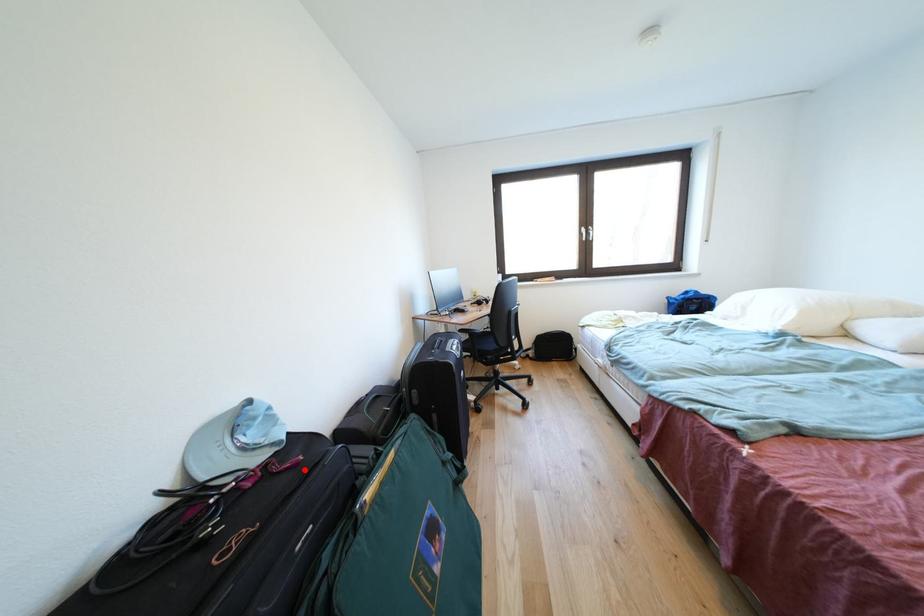
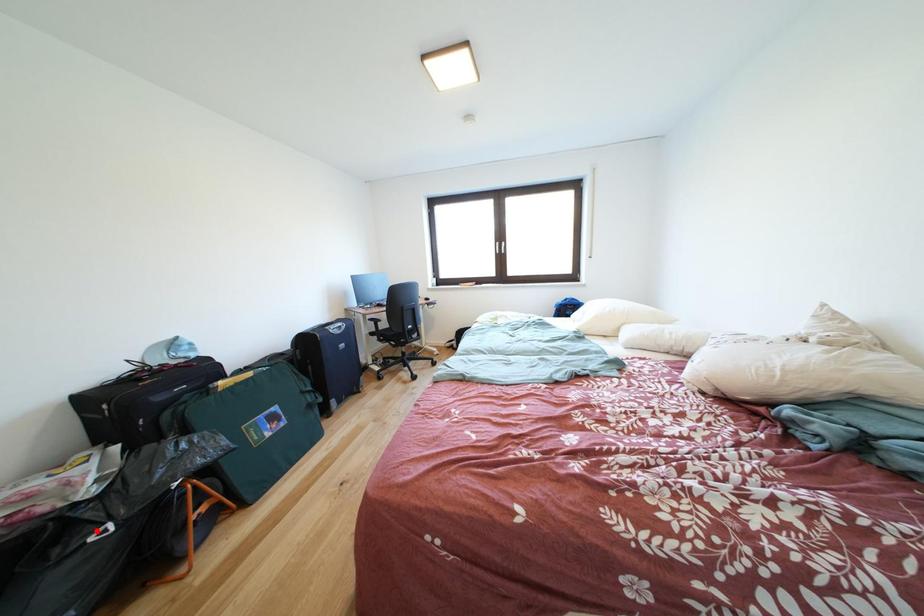
I am providing you with two images of the same scene from different viewpoints. A red point is marked on the first image and another point is marked on the second image. Does the point marked in image1 correspond to the same location as the one in image2?

No